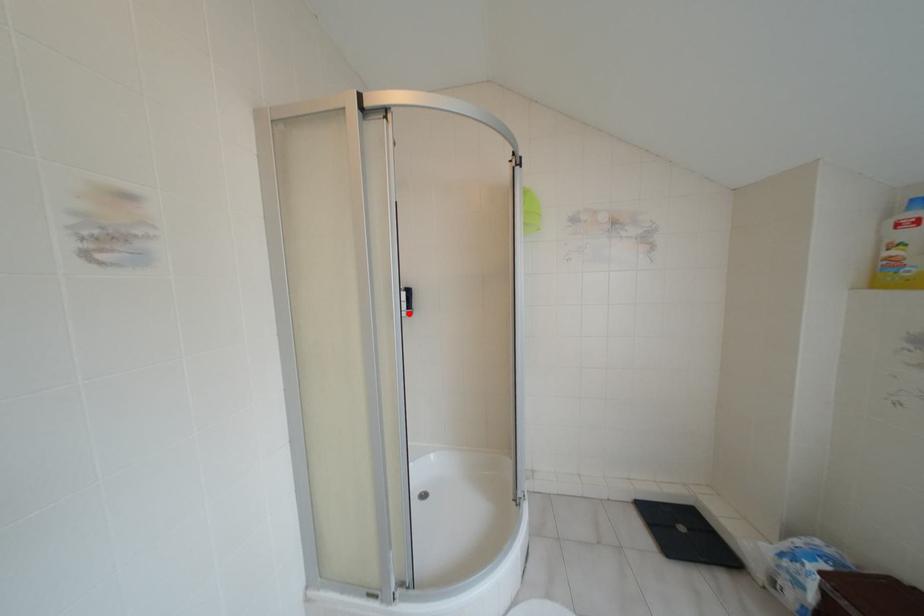
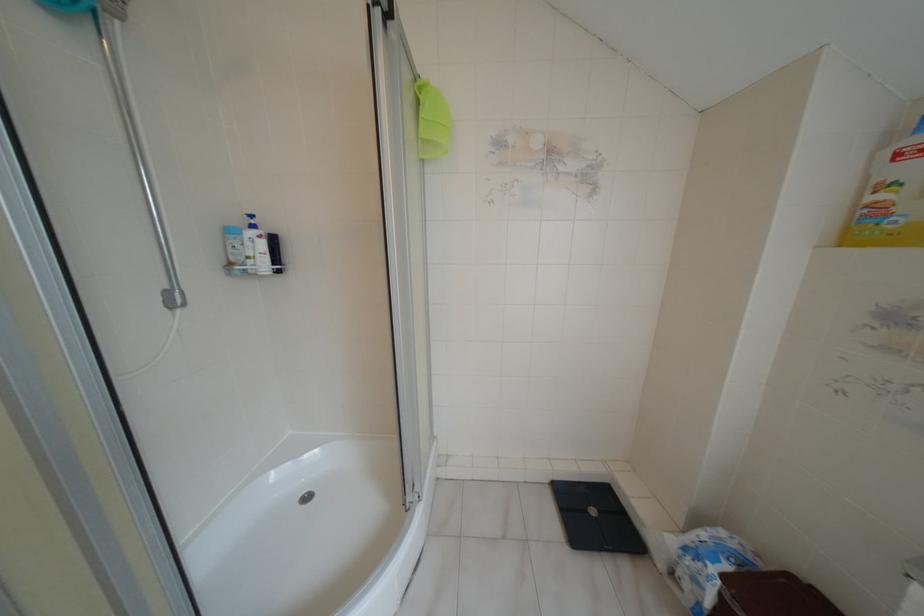
Locate, in the second image, the point that corresponds to the highlighted location in the first image.

(277, 270)